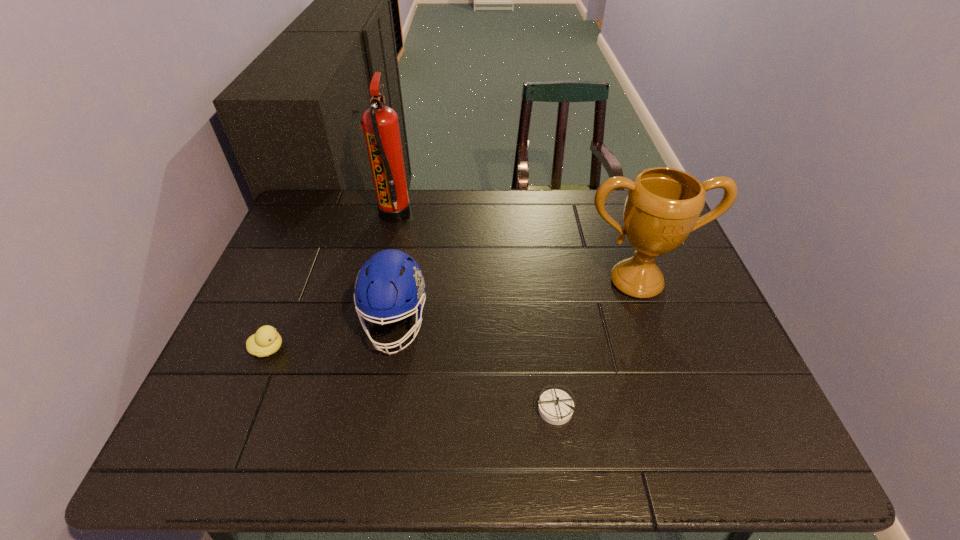
Find the location of a particular element. fire extinguisher is located at coordinates (380, 123).

Image resolution: width=960 pixels, height=540 pixels. What are the coordinates of `the tallest object` in the screenshot? It's located at (380, 123).

Locate an element on the screen. Image resolution: width=960 pixels, height=540 pixels. the rightmost object is located at coordinates (663, 205).

Image resolution: width=960 pixels, height=540 pixels. Identify the location of award. (663, 205).

Where is `the third shortest object`? the third shortest object is located at coordinates (390, 284).

Identify the location of the second shortest object. The height and width of the screenshot is (540, 960). pos(266,341).

What are the coordinates of `duckling` in the screenshot? It's located at (266, 341).

You are a GUI agent. You are given a task and a screenshot of the screen. Output one action in this format:
    pyautogui.click(x=<x>, y=<y>)
    Task: Click on the compass
    
    Given the screenshot: What is the action you would take?
    pyautogui.click(x=555, y=406)

Find the location of a particular element. the shortest object is located at coordinates (555, 406).

You are a GUI agent. You are given a task and a screenshot of the screen. Output one action in this format:
    pyautogui.click(x=<x>, y=<y>)
    Task: Click on the free space located with the nozzle pointing from the back of the farthest object
    The image size is (960, 540).
    Given the screenshot: What is the action you would take?
    pyautogui.click(x=536, y=214)